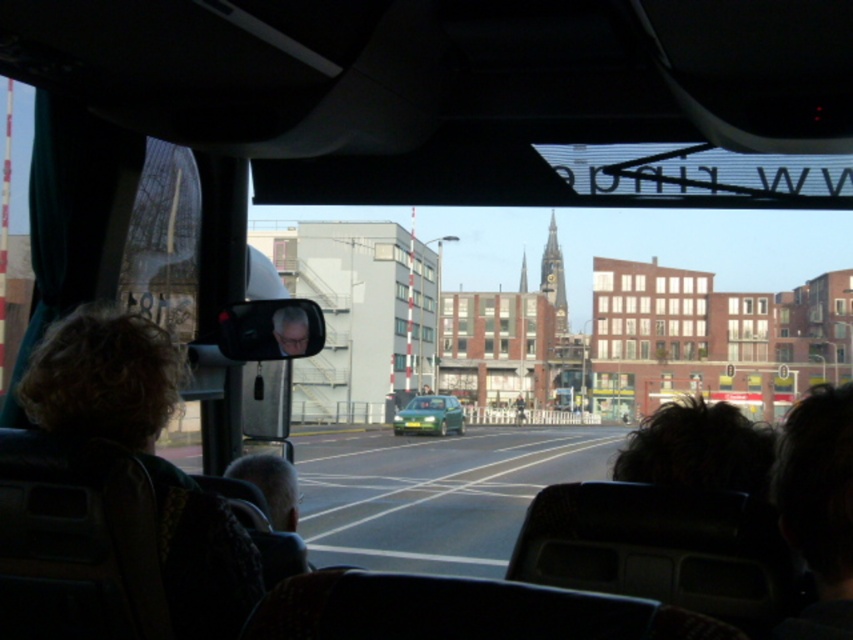
Question: Is dark brown hair at upper right to the left of gray hair at center from the viewer's perspective?

Choices:
 (A) yes
 (B) no

Answer: (B)

Question: Which point is closer to the camera?

Choices:
 (A) (796, 540)
 (B) (305, 332)
 (C) (248, 465)

Answer: (A)

Question: Based on their relative distances, which object is farther from the gray hair at center?

Choices:
 (A) matte plastic face at center
 (B) dark brown hair at upper right

Answer: (B)

Question: Considering the relative positions of dark brown hair at upper right and gray hair at center in the image provided, where is dark brown hair at upper right located with respect to gray hair at center?

Choices:
 (A) right
 (B) left

Answer: (A)

Question: Among these points, which one is nearest to the camera?

Choices:
 (A) (815, 460)
 (B) (265, 492)

Answer: (A)

Question: Can you confirm if dark brown hair at upper right is smaller than gray hair at center?

Choices:
 (A) yes
 (B) no

Answer: (B)